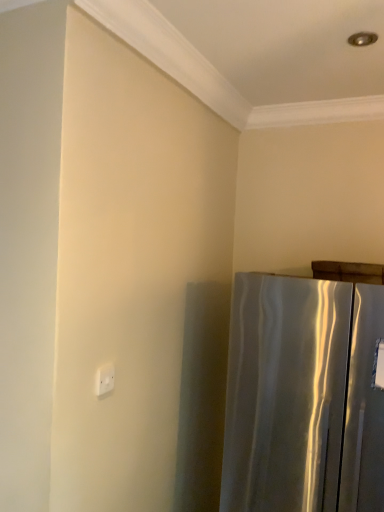
Question: Considering the relative sizes of satin silver refrigerator at right and white plastic electric outlet at upper left in the image provided, is satin silver refrigerator at right taller than white plastic electric outlet at upper left?

Choices:
 (A) yes
 (B) no

Answer: (A)

Question: Does satin silver refrigerator at right lie behind white plastic electric outlet at upper left?

Choices:
 (A) yes
 (B) no

Answer: (B)

Question: Is satin silver refrigerator at right outside of white plastic electric outlet at upper left?

Choices:
 (A) no
 (B) yes

Answer: (B)

Question: Would you say white plastic electric outlet at upper left is part of satin silver refrigerator at right's contents?

Choices:
 (A) yes
 (B) no

Answer: (B)

Question: From a real-world perspective, is satin silver refrigerator at right physically below white plastic electric outlet at upper left?

Choices:
 (A) no
 (B) yes

Answer: (B)

Question: Can you confirm if satin silver refrigerator at right is shorter than white plastic electric outlet at upper left?

Choices:
 (A) yes
 (B) no

Answer: (B)

Question: From a real-world perspective, is white plastic electric outlet at upper left over satin silver refrigerator at right?

Choices:
 (A) yes
 (B) no

Answer: (A)

Question: Can you confirm if white plastic electric outlet at upper left is taller than satin silver refrigerator at right?

Choices:
 (A) no
 (B) yes

Answer: (A)

Question: Is white plastic electric outlet at upper left wider than satin silver refrigerator at right?

Choices:
 (A) yes
 (B) no

Answer: (B)

Question: From the image's perspective, is white plastic electric outlet at upper left over satin silver refrigerator at right?

Choices:
 (A) no
 (B) yes

Answer: (B)

Question: Is white plastic electric outlet at upper left not inside satin silver refrigerator at right?

Choices:
 (A) yes
 (B) no

Answer: (A)

Question: Is satin silver refrigerator at right a part of white plastic electric outlet at upper left?

Choices:
 (A) yes
 (B) no

Answer: (B)

Question: In terms of height, does white plastic electric outlet at upper left look taller or shorter compared to satin silver refrigerator at right?

Choices:
 (A) tall
 (B) short

Answer: (B)